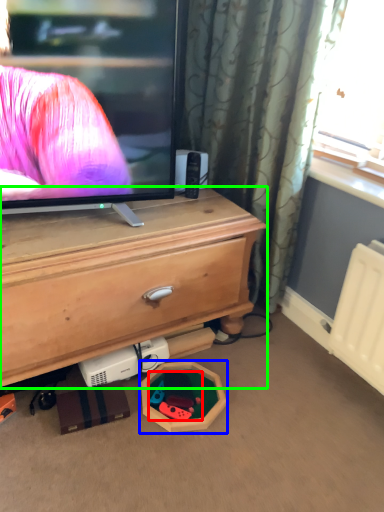
Question: Which object is positioned farthest from toy (highlighted by a red box)? Select from toy (highlighted by a blue box) and chest of drawers (highlighted by a green box).

Choices:
 (A) toy
 (B) chest of drawers

Answer: (B)